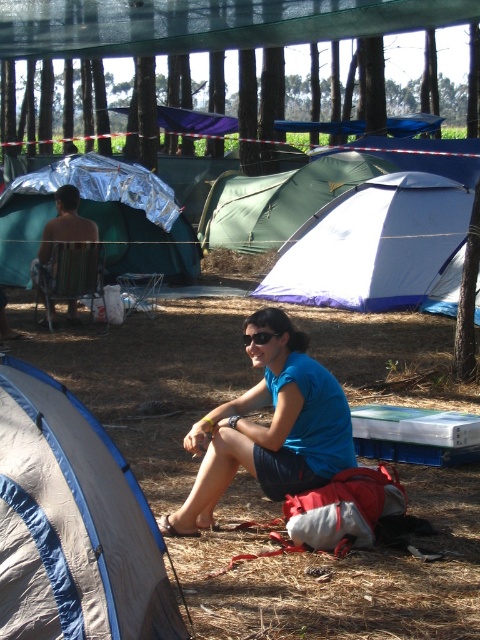
Does gray fabric tent at lower left appear under white nylon tent at center?

Correct, gray fabric tent at lower left is located below white nylon tent at center.

Can you confirm if gray fabric tent at lower left is positioned to the left of white nylon tent at center?

Yes, gray fabric tent at lower left is to the left of white nylon tent at center.

Locate an element on the screen. The image size is (480, 640). gray fabric tent at lower left is located at coordinates (72, 524).

The height and width of the screenshot is (640, 480). Identify the location of gray fabric tent at lower left. (72, 524).

Locate an element on the screen. The image size is (480, 640). blue fabric shorts at center is located at coordinates (269, 428).

Which is behind, point (272, 499) or point (163, 260)?

The point (163, 260) is behind.

What do you see at coordinates (269, 428) in the screenshot? The width and height of the screenshot is (480, 640). I see `blue fabric shorts at center` at bounding box center [269, 428].

Locate an element on the screen. The width and height of the screenshot is (480, 640). blue fabric shorts at center is located at coordinates (269, 428).

The height and width of the screenshot is (640, 480). What do you see at coordinates (373, 244) in the screenshot? I see `white nylon tent at center` at bounding box center [373, 244].

Does white nylon tent at center lie in front of black plastic goggles at center?

That is False.

This screenshot has width=480, height=640. In order to click on white nylon tent at center in this screenshot , I will do `click(373, 244)`.